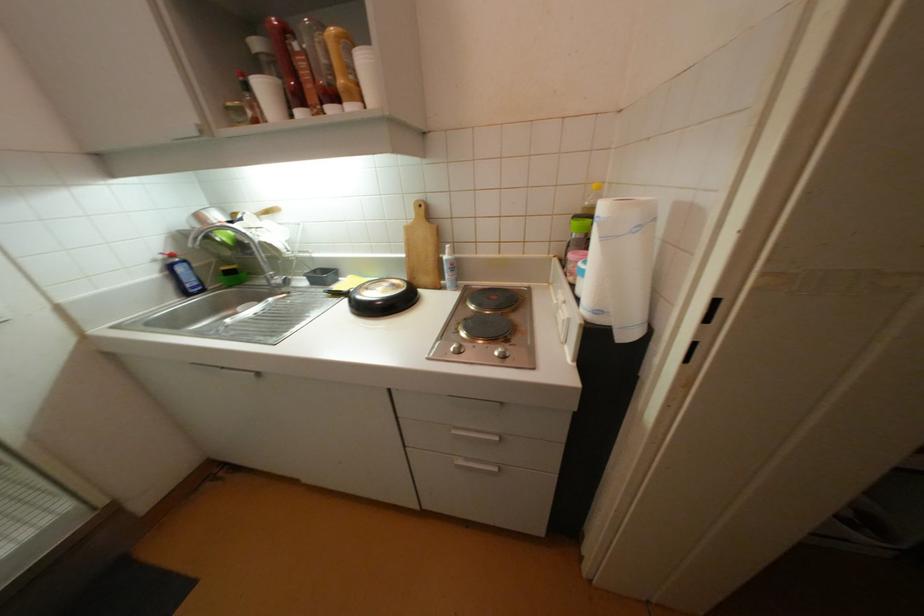
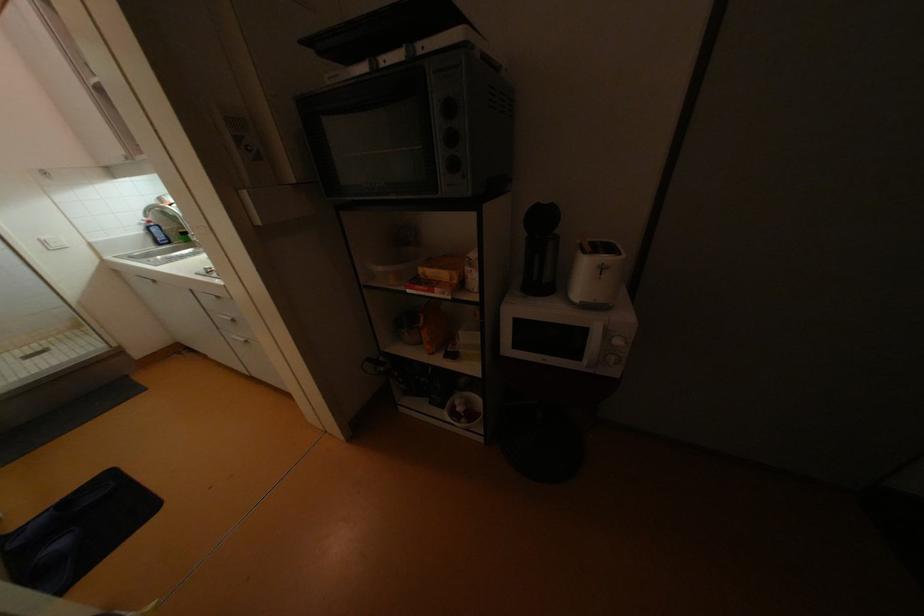
In the second image, find the point that corresponds to point 187,270 in the first image.

(160, 231)